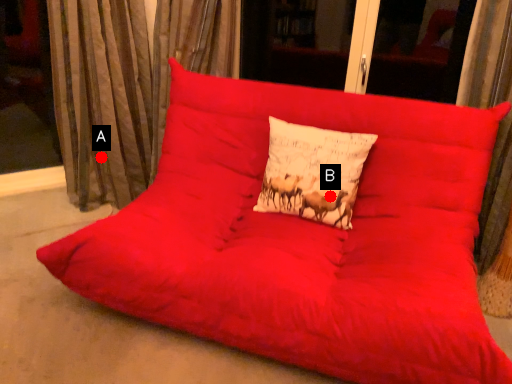
Question: Two points are circled on the image, labeled by A and B beside each circle. Which point is closer to the camera taking this photo?

Choices:
 (A) A is closer
 (B) B is closer

Answer: (B)